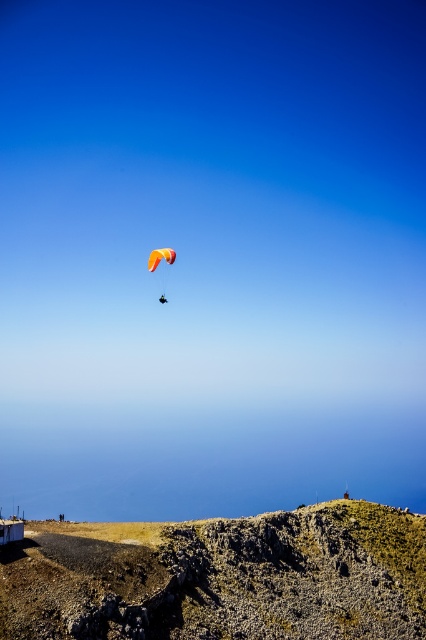
Does rugged stone hillside at lower center appear over orange fabric parachute at center?

Actually, rugged stone hillside at lower center is below orange fabric parachute at center.

Which is behind, point (157, 524) or point (158, 260)?

The point (158, 260) is more distant.

What do you see at coordinates (221, 577) in the screenshot?
I see `rugged stone hillside at lower center` at bounding box center [221, 577].

Where is `rugged stone hillside at lower center`? rugged stone hillside at lower center is located at coordinates (221, 577).